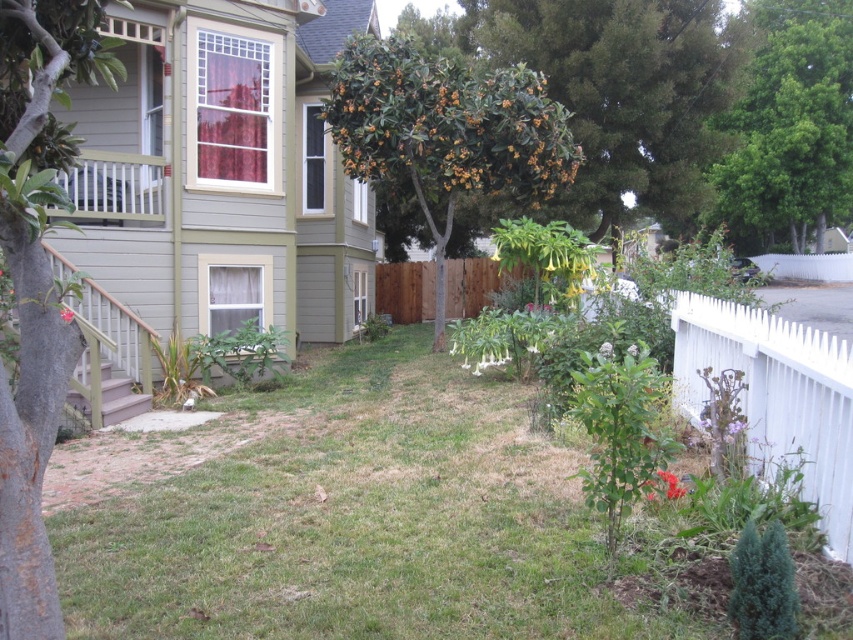
Can you confirm if green leafy tree at upper right is smaller than red matte flower at center?

Incorrect, green leafy tree at upper right is not smaller in size than red matte flower at center.

Is green leafy tree at upper right further to the viewer compared to red matte flower at center?

Yes, it is behind red matte flower at center.

Locate an element on the screen. green leafy tree at upper right is located at coordinates (792, 122).

Is green leafy tree at center behind green leafy tree at upper right?

No, green leafy tree at center is closer to the viewer.

Which is behind, point (544, 156) or point (815, 172)?

The point (815, 172) is behind.

Locate an element on the screen. green leafy tree at center is located at coordinates (445, 132).

Does white fuzzy flower at center appear on the left side of purple matte flower at center?

Correct, you'll find white fuzzy flower at center to the left of purple matte flower at center.

Who is shorter, white fuzzy flower at center or purple matte flower at center?

purple matte flower at center is shorter.

Describe the element at coordinates (605, 349) in the screenshot. This screenshot has height=640, width=853. I see `white fuzzy flower at center` at that location.

The image size is (853, 640). I want to click on white fuzzy flower at center, so click(605, 349).